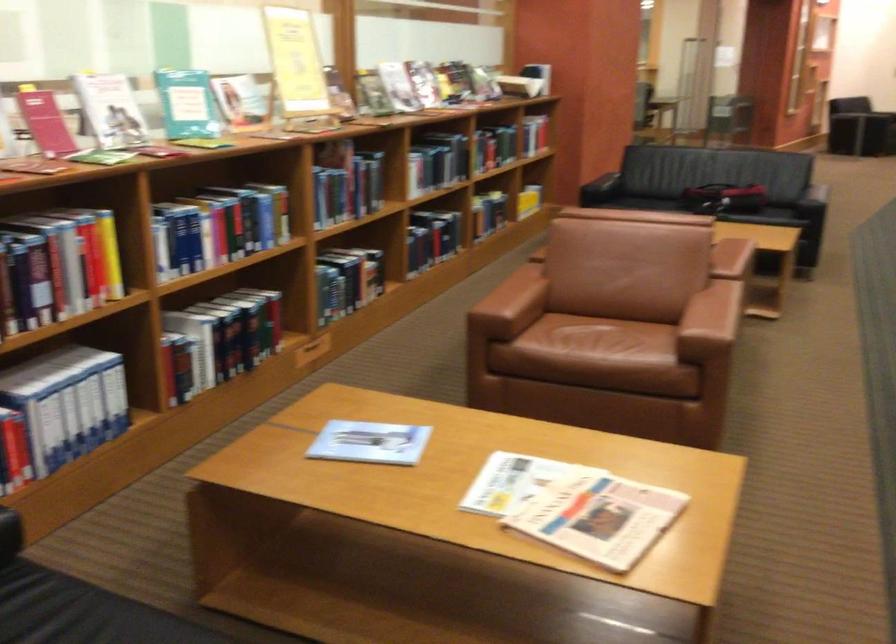
This screenshot has height=644, width=896. Describe the element at coordinates (647, 203) in the screenshot. I see `the sofa sitting surface` at that location.